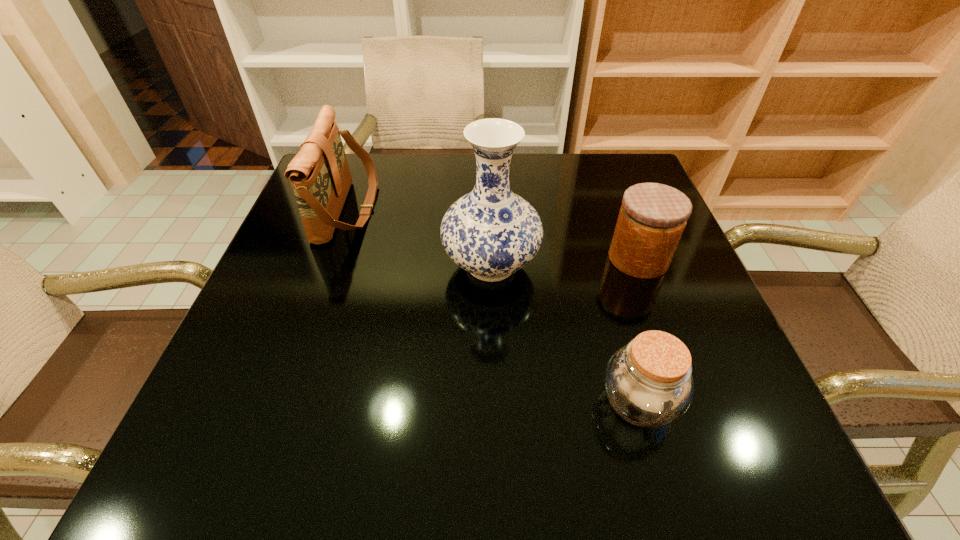
Where is `object that is at the far edge`? object that is at the far edge is located at coordinates (319, 174).

The image size is (960, 540). Identify the location of object that is positioned at the near edge. (648, 382).

Identify the location of object at the left edge. (319, 174).

Locate an element on the screen. object at the far left corner is located at coordinates (319, 174).

The image size is (960, 540). I want to click on object positioned at the near right corner, so click(x=648, y=382).

At what (x,y) coordinates should I click in order to perform the action: click on free space at the far edge of the desktop. Please return your answer as a coordinate pair (x, y). This screenshot has height=540, width=960. Looking at the image, I should click on (451, 185).

In the image, there is a desktop. Where is `vacant area at the near edge`? This screenshot has width=960, height=540. vacant area at the near edge is located at coordinates (523, 449).

The height and width of the screenshot is (540, 960). I want to click on vacant space at the left edge, so click(x=321, y=289).

I want to click on blank area at the right edge, so click(627, 286).

Locate an element on the screen. This screenshot has width=960, height=540. free space at the near left corner of the desktop is located at coordinates 288,461.